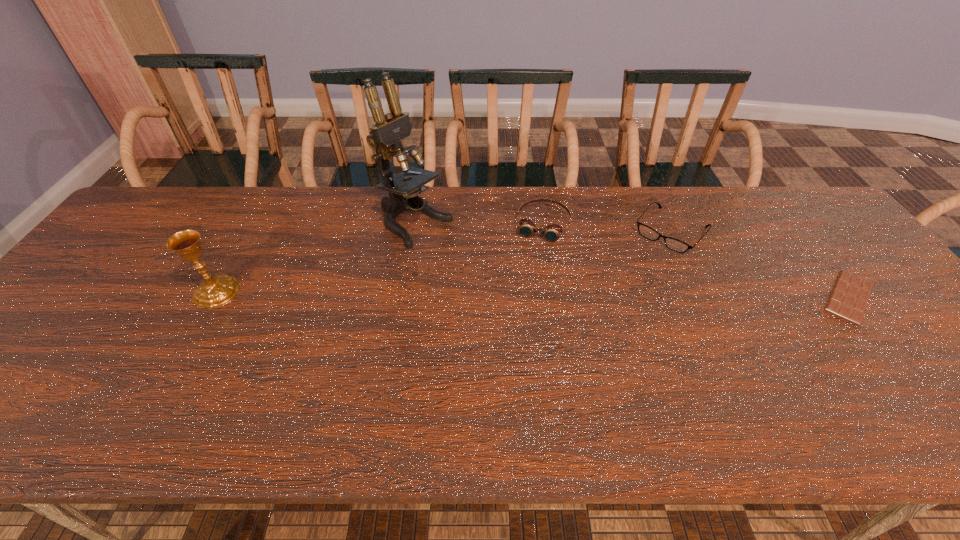
Where is `vacant space located 0.240m through the lenses of the goggles`? vacant space located 0.240m through the lenses of the goggles is located at coordinates (518, 305).

Locate an element on the screen. The width and height of the screenshot is (960, 540). spectacles that is at the far edge is located at coordinates (673, 244).

Where is `microscope located at the far edge`? The height and width of the screenshot is (540, 960). microscope located at the far edge is located at coordinates (385, 137).

Identify the location of goggles that is positioned at the far edge. (552, 232).

Where is `object present at the right edge`? object present at the right edge is located at coordinates (849, 297).

Locate an element on the screen. vacant space at the far edge is located at coordinates [x=501, y=190].

The height and width of the screenshot is (540, 960). Find the location of `vacant space at the near edge of the desktop`. vacant space at the near edge of the desktop is located at coordinates (402, 396).

Find the location of a particular element. The height and width of the screenshot is (540, 960). free region at the left edge of the desktop is located at coordinates (118, 237).

This screenshot has height=540, width=960. What are the coordinates of `vacant region at the right edge of the desktop` in the screenshot? It's located at (893, 322).

You are a GUI agent. You are given a task and a screenshot of the screen. Output one action in this format:
    pyautogui.click(x=<x>, y=<y>)
    Task: Click on the free spot at the far right corner of the desktop
    
    Given the screenshot: What is the action you would take?
    pyautogui.click(x=799, y=187)